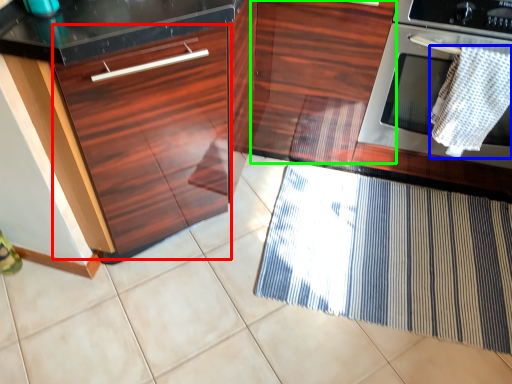
Question: Which is farther away from drawer (highlighted by a red box)? blanket (highlighted by a blue box) or cabinetry (highlighted by a green box)?

Choices:
 (A) blanket
 (B) cabinetry

Answer: (A)